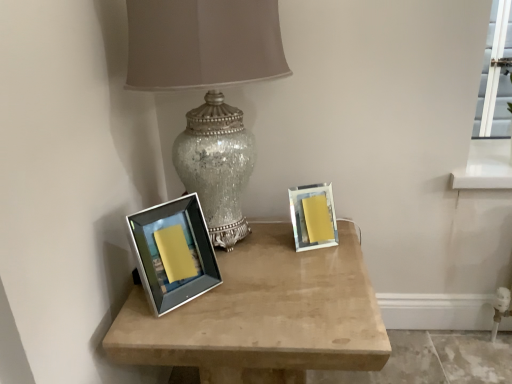
Describe the element at coordinates (313, 216) in the screenshot. I see `matte silver picture frame at right, the 2th picture frame when ordered from front to back` at that location.

Where is `crackle glass lamp at center`? The width and height of the screenshot is (512, 384). crackle glass lamp at center is located at coordinates (203, 43).

Describe the element at coordinates (203, 43) in the screenshot. I see `crackle glass lamp at center` at that location.

The width and height of the screenshot is (512, 384). In order to click on matte silver picture frame at right, the 2th picture frame when ordered from front to back in this screenshot , I will do `click(313, 216)`.

Who is smaller, satin silver frame at center or matte silver picture frame at right, which appears as the 2th picture frame when viewed from the left?

Smaller between the two is matte silver picture frame at right, which appears as the 2th picture frame when viewed from the left.

From the image's perspective, does satin silver frame at center appear higher than matte silver picture frame at right, positioned as the 1th picture frame in right-to-left order?

Actually, satin silver frame at center appears below matte silver picture frame at right, positioned as the 1th picture frame in right-to-left order, in the image.

Could matte silver picture frame at right, the 2th picture frame when ordered from front to back, be considered to be inside satin silver frame at center?

No, satin silver frame at center does not contain matte silver picture frame at right, the 2th picture frame when ordered from front to back.

Which is more to the left, satin silver frame at center or matte silver picture frame at right, the 2th picture frame when ordered from front to back?

Positioned to the left is satin silver frame at center.

Is matte silver picture frame at right, positioned as the 1th picture frame in right-to-left order, positioned in front of satin silver frame at center?

No, matte silver picture frame at right, positioned as the 1th picture frame in right-to-left order, is further to the viewer.

Which of these two, matte silver picture frame at right, the 2th picture frame when ordered from front to back, or satin silver frame at center, stands shorter?

matte silver picture frame at right, the 2th picture frame when ordered from front to back.

Considering the points (314, 225) and (344, 320), which point is in front, point (314, 225) or point (344, 320)?

Positioned in front is point (344, 320).

Measure the distance from matte silver picture frame at right, the 2th picture frame when ordered from front to back, to satin silver frame at center.

matte silver picture frame at right, the 2th picture frame when ordered from front to back, and satin silver frame at center are 9.73 inches apart from each other.

From a real-world perspective, is matte silver picture frame at right, positioned as the 1th picture frame in right-to-left order, located beneath crackle glass lamp at center?

Correct, in the physical world, matte silver picture frame at right, positioned as the 1th picture frame in right-to-left order, is lower than crackle glass lamp at center.

You are a GUI agent. You are given a task and a screenshot of the screen. Output one action in this format:
    pyautogui.click(x=<x>, y=<y>)
    Task: Click on the lamp in front of the matte silver picture frame at right, which appears as the 2th picture frame when viewed from the left
    Image resolution: width=512 pixels, height=384 pixels.
    Given the screenshot: What is the action you would take?
    pyautogui.click(x=203, y=43)

Considering the sizes of objects matte silver picture frame at right, the 2th picture frame when ordered from front to back, and crackle glass lamp at center in the image provided, who is thinner, matte silver picture frame at right, the 2th picture frame when ordered from front to back, or crackle glass lamp at center?

matte silver picture frame at right, the 2th picture frame when ordered from front to back.

From the image's perspective, between matte silver picture frame at right, which appears as the 2th picture frame when viewed from the left, and crackle glass lamp at center, who is located below?

From the image's view, matte silver picture frame at right, which appears as the 2th picture frame when viewed from the left, is below.

Can you confirm if satin silver frame at center is thinner than silver/metallic picture frame at left, which appears as the 2th picture frame when viewed from the right?

No.

From the image's perspective, is satin silver frame at center above or below silver/metallic picture frame at left, the first picture frame viewed from the front?

satin silver frame at center is below silver/metallic picture frame at left, the first picture frame viewed from the front.

Considering the sizes of objects satin silver frame at center and silver/metallic picture frame at left, the second picture frame viewed from the back, in the image provided, who is smaller, satin silver frame at center or silver/metallic picture frame at left, the second picture frame viewed from the back,?

Smaller between the two is silver/metallic picture frame at left, the second picture frame viewed from the back.

Is satin silver frame at center with silver/metallic picture frame at left, which appears as the 2th picture frame when viewed from the right?

satin silver frame at center is not next to silver/metallic picture frame at left, which appears as the 2th picture frame when viewed from the right, and they're not touching.

Is satin silver frame at center far from crackle glass lamp at center?

No, satin silver frame at center is in close proximity to crackle glass lamp at center.

From a real-world perspective, which object stands above the other?

In real-world perspective, crackle glass lamp at center is above.

From the image's perspective, does satin silver frame at center appear lower than crackle glass lamp at center?

Yes, from the image's perspective, satin silver frame at center is beneath crackle glass lamp at center.

Looking at their sizes, would you say satin silver frame at center is wider or thinner than crackle glass lamp at center?

In the image, satin silver frame at center appears to be wider than crackle glass lamp at center.

Can you confirm if silver/metallic picture frame at left, the second picture frame viewed from the back, is positioned to the right of satin silver frame at center?

Incorrect, silver/metallic picture frame at left, the second picture frame viewed from the back, is not on the right side of satin silver frame at center.

Can you confirm if silver/metallic picture frame at left, the first picture frame viewed from the front, is smaller than satin silver frame at center?

Correct, silver/metallic picture frame at left, the first picture frame viewed from the front, occupies less space than satin silver frame at center.

Which is further, (x=179, y=259) or (x=339, y=363)?

The point (x=179, y=259) is farther.

Based on the photo, can you tell me how much silver/metallic picture frame at left, arranged as the 1th picture frame when viewed from the left, and satin silver frame at center differ in facing direction?

silver/metallic picture frame at left, arranged as the 1th picture frame when viewed from the left, and satin silver frame at center are facing 41 degrees away from each other.

Is crackle glass lamp at center not near silver/metallic picture frame at left, the second picture frame viewed from the back?

They are positioned close to each other.

Is point (197, 1) positioned before point (168, 206)?

Yes, point (197, 1) is closer to viewer.

From the image's perspective, which is above, crackle glass lamp at center or silver/metallic picture frame at left, which appears as the 2th picture frame when viewed from the right?

crackle glass lamp at center, from the image's perspective.

From the image's perspective, count 2nd picture frames upward from the satin silver frame at center and point to it. Please provide its 2D coordinates.

[(313, 216)]

The image size is (512, 384). Identify the location of table below the matte silver picture frame at right, the 2th picture frame when ordered from front to back (from a real-world perspective). (264, 315).

Looking at the image, which one is located closer to crackle glass lamp at center, satin silver frame at center or matte silver picture frame at right, the 2th picture frame when ordered from front to back?

matte silver picture frame at right, the 2th picture frame when ordered from front to back, is closer to crackle glass lamp at center.

From the image, which object appears to be nearer to matte silver picture frame at right, the first picture frame viewed from the back, silver/metallic picture frame at left, which appears as the 2th picture frame when viewed from the right, or crackle glass lamp at center?

crackle glass lamp at center is positioned closer to the anchor matte silver picture frame at right, the first picture frame viewed from the back.

Considering their positions, is satin silver frame at center positioned further to silver/metallic picture frame at left, the second picture frame viewed from the back, than crackle glass lamp at center?

Based on the image, crackle glass lamp at center appears to be further to silver/metallic picture frame at left, the second picture frame viewed from the back.

Based on the photo, based on their spatial positions, is matte silver picture frame at right, positioned as the 1th picture frame in right-to-left order, or crackle glass lamp at center closer to satin silver frame at center?

The object closer to satin silver frame at center is matte silver picture frame at right, positioned as the 1th picture frame in right-to-left order.

Based on their spatial positions, is matte silver picture frame at right, the 2th picture frame when ordered from front to back, or satin silver frame at center further from silver/metallic picture frame at left, arranged as the 1th picture frame when viewed from the left?

matte silver picture frame at right, the 2th picture frame when ordered from front to back, is positioned further to the anchor silver/metallic picture frame at left, arranged as the 1th picture frame when viewed from the left.

Considering their positions, is satin silver frame at center positioned further to matte silver picture frame at right, which appears as the 2th picture frame when viewed from the left, than silver/metallic picture frame at left, which appears as the 2th picture frame when viewed from the right?

Among the two, silver/metallic picture frame at left, which appears as the 2th picture frame when viewed from the right, is located further to matte silver picture frame at right, which appears as the 2th picture frame when viewed from the left.

Based on their spatial positions, is crackle glass lamp at center or silver/metallic picture frame at left, arranged as the 1th picture frame when viewed from the left, further from satin silver frame at center?

crackle glass lamp at center lies further to satin silver frame at center than the other object.

From the image, which object appears to be farther from matte silver picture frame at right, the first picture frame viewed from the back, satin silver frame at center or crackle glass lamp at center?

The object further to matte silver picture frame at right, the first picture frame viewed from the back, is crackle glass lamp at center.

Where is `table situated between silver/metallic picture frame at left, the first picture frame viewed from the front, and matte silver picture frame at right, the first picture frame viewed from the back, from left to right`? table situated between silver/metallic picture frame at left, the first picture frame viewed from the front, and matte silver picture frame at right, the first picture frame viewed from the back, from left to right is located at coordinates (264, 315).

The width and height of the screenshot is (512, 384). Find the location of `lamp between silver/metallic picture frame at left, the first picture frame viewed from the front, and matte silver picture frame at right, positioned as the 1th picture frame in right-to-left order`. lamp between silver/metallic picture frame at left, the first picture frame viewed from the front, and matte silver picture frame at right, positioned as the 1th picture frame in right-to-left order is located at coordinates (203, 43).